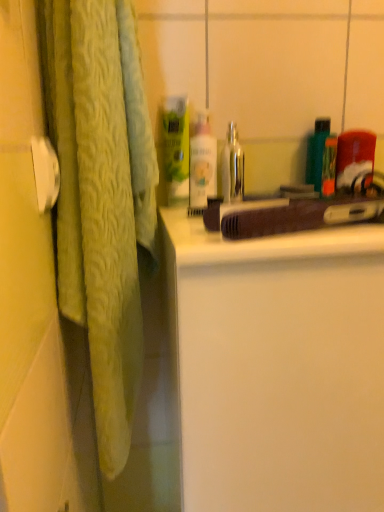
Question: Does brown matte hairdryer at center have a greater height compared to white matte cabinet at center?

Choices:
 (A) yes
 (B) no

Answer: (B)

Question: From a real-world perspective, does brown matte hairdryer at center sit lower than white matte cabinet at center?

Choices:
 (A) yes
 (B) no

Answer: (B)

Question: From the image's perspective, is brown matte hairdryer at center above white matte cabinet at center?

Choices:
 (A) yes
 (B) no

Answer: (A)

Question: Is brown matte hairdryer at center with white matte cabinet at center?

Choices:
 (A) no
 (B) yes

Answer: (A)

Question: Could you tell me if brown matte hairdryer at center is turned towards white matte cabinet at center?

Choices:
 (A) yes
 (B) no

Answer: (B)

Question: From a real-world perspective, relative to white matte cabinet at center, is white glossy lotion at center vertically above or below?

Choices:
 (A) above
 (B) below

Answer: (A)

Question: From their relative heights in the image, would you say white glossy lotion at center is taller or shorter than white matte cabinet at center?

Choices:
 (A) short
 (B) tall

Answer: (A)

Question: Looking at their shapes, would you say white glossy lotion at center is wider or thinner than white matte cabinet at center?

Choices:
 (A) thin
 (B) wide

Answer: (A)

Question: Considering the positions of point (190, 184) and point (284, 336), is point (190, 184) closer or farther from the camera than point (284, 336)?

Choices:
 (A) farther
 (B) closer

Answer: (A)

Question: Relative to brown matte hairdryer at center, is white glossy lotion at center in front or behind?

Choices:
 (A) behind
 (B) front

Answer: (A)

Question: Considering the relative positions of white glossy lotion at center and brown matte hairdryer at center in the image provided, is white glossy lotion at center to the left or to the right of brown matte hairdryer at center?

Choices:
 (A) right
 (B) left

Answer: (B)

Question: Choose the correct answer: Is white glossy lotion at center inside brown matte hairdryer at center or outside it?

Choices:
 (A) inside
 (B) outside

Answer: (B)

Question: From the image's perspective, is white glossy lotion at center positioned above or below brown matte hairdryer at center?

Choices:
 (A) below
 (B) above

Answer: (B)

Question: Is brown matte hairdryer at center bigger or smaller than white matte cabinet at center?

Choices:
 (A) big
 (B) small

Answer: (B)

Question: From their relative heights in the image, would you say brown matte hairdryer at center is taller or shorter than white matte cabinet at center?

Choices:
 (A) short
 (B) tall

Answer: (A)